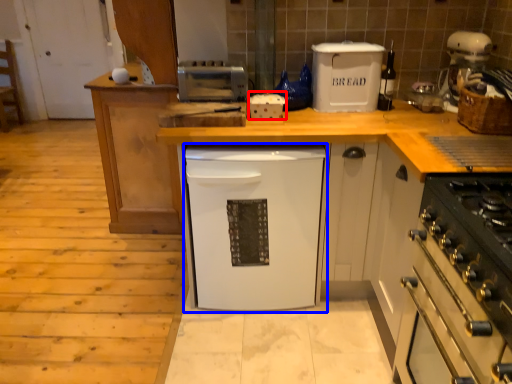
Question: Among these objects, which one is farthest to the camera, appliance (highlighted by a red box) or dish washer (highlighted by a blue box)?

Choices:
 (A) appliance
 (B) dish washer

Answer: (A)